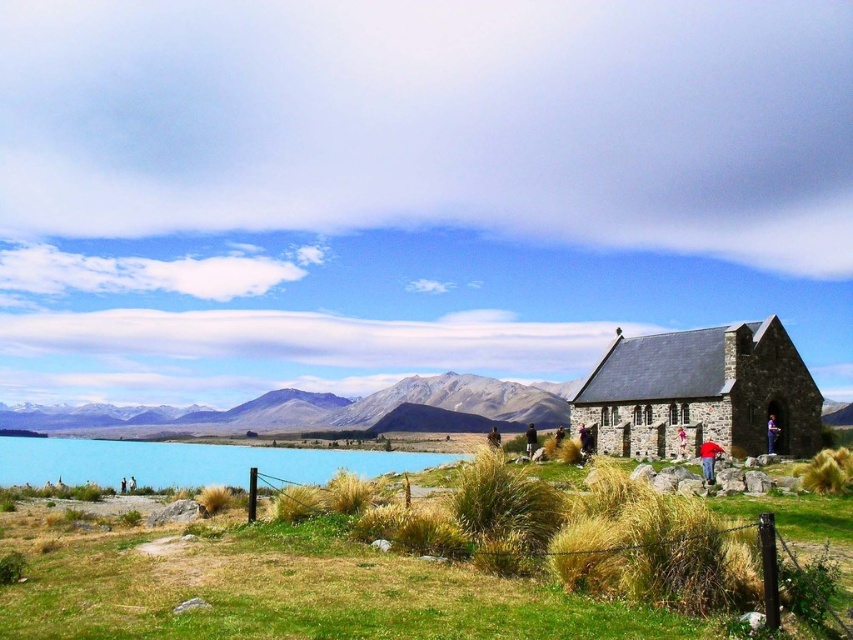
You are a landscape photographer planning to capture the church in this scene. You want to ensure the dry grass at center and blue glassy lake at lower left are both visible in your shot. Given their sizes, which object should you focus on to include both in the frame?

Since the dry grass at center is larger than the blue glassy lake at lower left, you should focus on the dry grass at center to ensure both objects are visible in the frame.

Based on the scene description, where is the dry grass at center located in terms of coordinates?

The dry grass at center is located at point coordinates of [288,589].